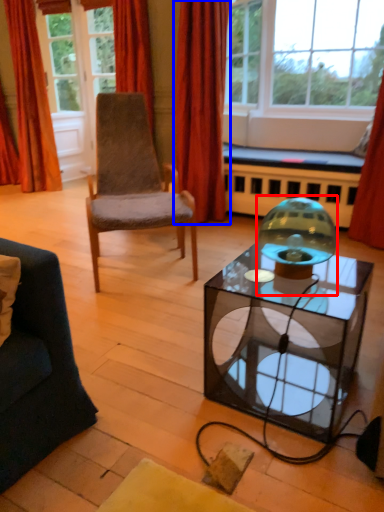
Question: Which object is closer to the camera taking this photo, candle holder (highlighted by a red box) or curtain (highlighted by a blue box)?

Choices:
 (A) candle holder
 (B) curtain

Answer: (A)